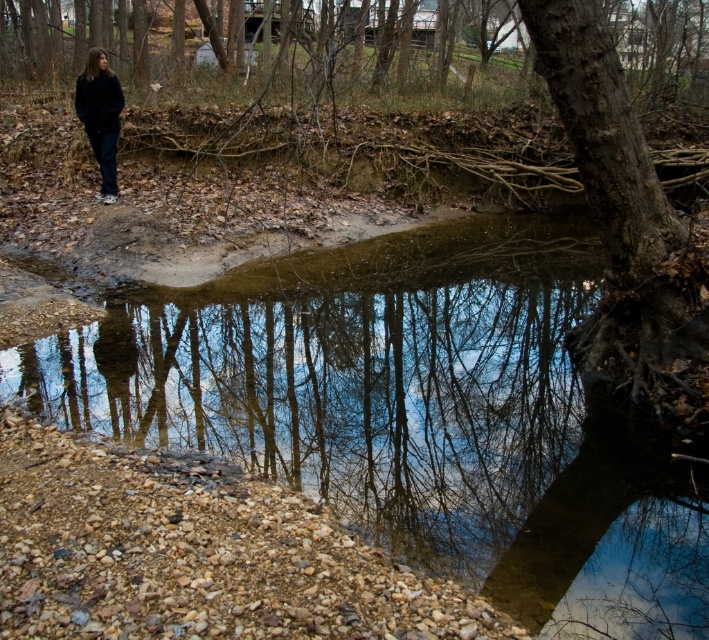
You are a hiker who wants to cross the stream safely. You see the clear water at center and the dark blue jeans at left. Which direction should you walk to avoid getting your shoes wet?

You should walk towards the dark blue jeans at left because the clear water at center is to the right of it, meaning the dry land is near the dark blue jeans at left.

You are standing at the edge of the stream and want to step onto the dark blue jeans at left. Is the clear water at center wide enough to step over?

The clear water at center might be wider than dark blue jeans at left, so it might be difficult to step over without getting wet.